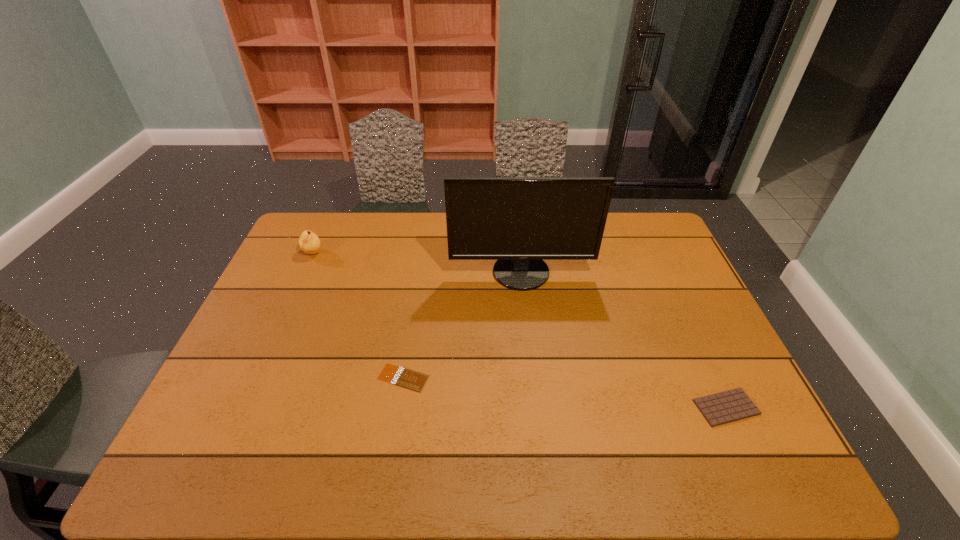
The width and height of the screenshot is (960, 540). In the image, there is a desktop. In order to click on vacant space at the far right corner in this screenshot , I will do `click(621, 221)`.

Locate an element on the screen. The height and width of the screenshot is (540, 960). free space between the second shortest object and the shorter chocolate bar is located at coordinates point(564,393).

Image resolution: width=960 pixels, height=540 pixels. What are the coordinates of `blank region between the second tallest object and the monitor` in the screenshot? It's located at (417, 262).

Where is `free space between the tallest object and the second tallest object`? The width and height of the screenshot is (960, 540). free space between the tallest object and the second tallest object is located at coordinates (417, 262).

Where is `vacant space in between the tallest object and the pear`? vacant space in between the tallest object and the pear is located at coordinates (417, 262).

This screenshot has width=960, height=540. Identify the location of free space between the pear and the monitor. (417, 262).

Find the location of a particular element. Image resolution: width=960 pixels, height=540 pixels. free space between the second object from left to right and the monitor is located at coordinates (462, 325).

You are a GUI agent. You are given a task and a screenshot of the screen. Output one action in this format:
    pyautogui.click(x=<x>, y=<y>)
    Task: Click on the vacant point located between the shortest object and the tallest object
    
    Given the screenshot: What is the action you would take?
    pyautogui.click(x=462, y=325)

The width and height of the screenshot is (960, 540). What are the coordinates of `free point between the pear and the second shortest object` in the screenshot? It's located at (519, 330).

This screenshot has height=540, width=960. Find the location of `empty location between the tallest object and the shortest object`. empty location between the tallest object and the shortest object is located at coordinates (462, 325).